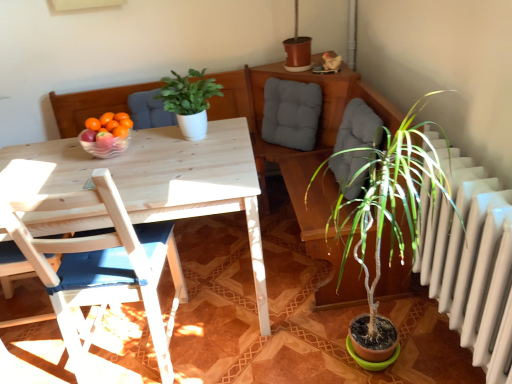
Question: From a real-world perspective, is gray fabric cushion at upper center positioned over transparent glass bowl at table based on gravity?

Choices:
 (A) yes
 (B) no

Answer: (B)

Question: Would you say gray fabric cushion at upper center is outside transparent glass bowl at table?

Choices:
 (A) no
 (B) yes

Answer: (B)

Question: Is gray fabric cushion at upper center not close to transparent glass bowl at table?

Choices:
 (A) yes
 (B) no

Answer: (B)

Question: Is transparent glass bowl at table located within gray fabric cushion at upper center?

Choices:
 (A) yes
 (B) no

Answer: (B)

Question: Are gray fabric cushion at upper center and transparent glass bowl at table making contact?

Choices:
 (A) no
 (B) yes

Answer: (A)

Question: Based on their positions, is wooden chair with blue cushion at left located to the left or right of transparent glass bowl at table?

Choices:
 (A) right
 (B) left

Answer: (A)

Question: In terms of height, does wooden chair with blue cushion at left look taller or shorter compared to transparent glass bowl at table?

Choices:
 (A) short
 (B) tall

Answer: (B)

Question: From a real-world perspective, is wooden chair with blue cushion at left physically located above or below transparent glass bowl at table?

Choices:
 (A) above
 (B) below

Answer: (B)

Question: Considering the positions of wooden chair with blue cushion at left and transparent glass bowl at table in the image, is wooden chair with blue cushion at left bigger or smaller than transparent glass bowl at table?

Choices:
 (A) small
 (B) big

Answer: (B)

Question: From the image's perspective, relative to gray fabric cushion at upper center, is transparent glass bowl at table above or below?

Choices:
 (A) above
 (B) below

Answer: (B)

Question: Relative to gray fabric cushion at upper center, is transparent glass bowl at table in front or behind?

Choices:
 (A) behind
 (B) front

Answer: (B)

Question: Based on their positions, is transparent glass bowl at table located to the left or right of gray fabric cushion at upper center?

Choices:
 (A) left
 (B) right

Answer: (A)

Question: Looking at their shapes, would you say transparent glass bowl at table is wider or thinner than gray fabric cushion at upper center?

Choices:
 (A) wide
 (B) thin

Answer: (A)

Question: Considering the positions of wooden chair with blue cushion at left and green matte plant at center in the image, is wooden chair with blue cushion at left taller or shorter than green matte plant at center?

Choices:
 (A) tall
 (B) short

Answer: (A)

Question: In the image, is wooden chair with blue cushion at left on the left side or the right side of green matte plant at center?

Choices:
 (A) left
 (B) right

Answer: (A)